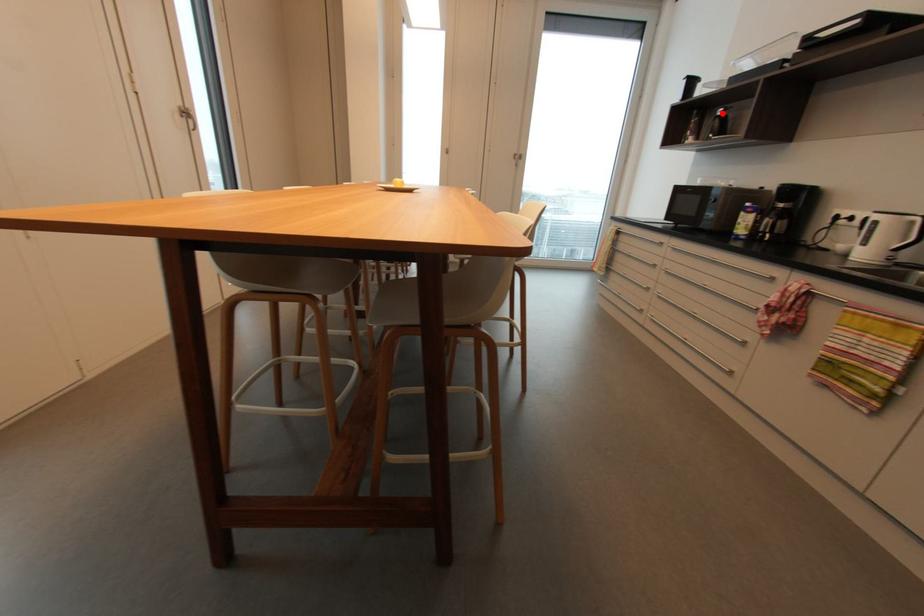
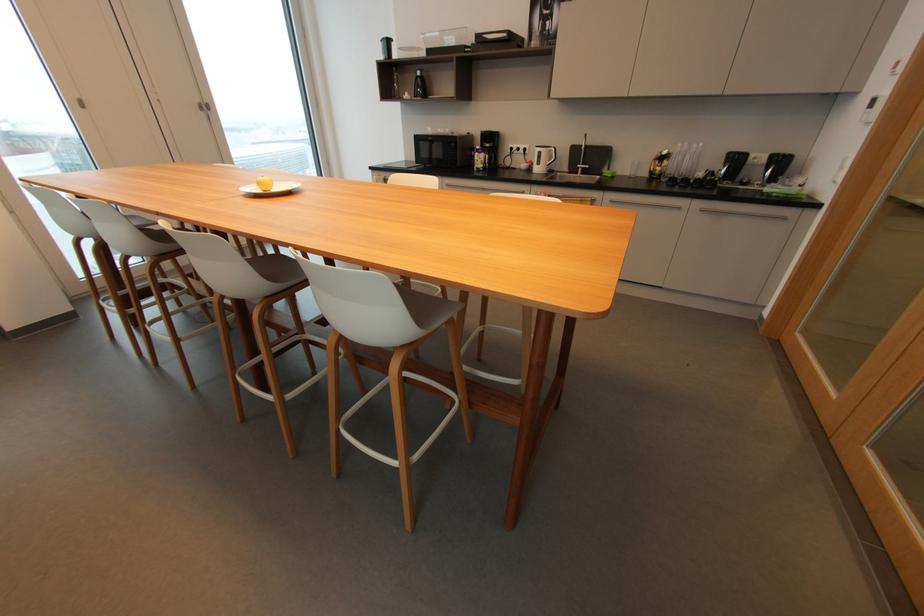
Where in the second image is the point corresponding to the highlighted location from the first image?

(421, 74)